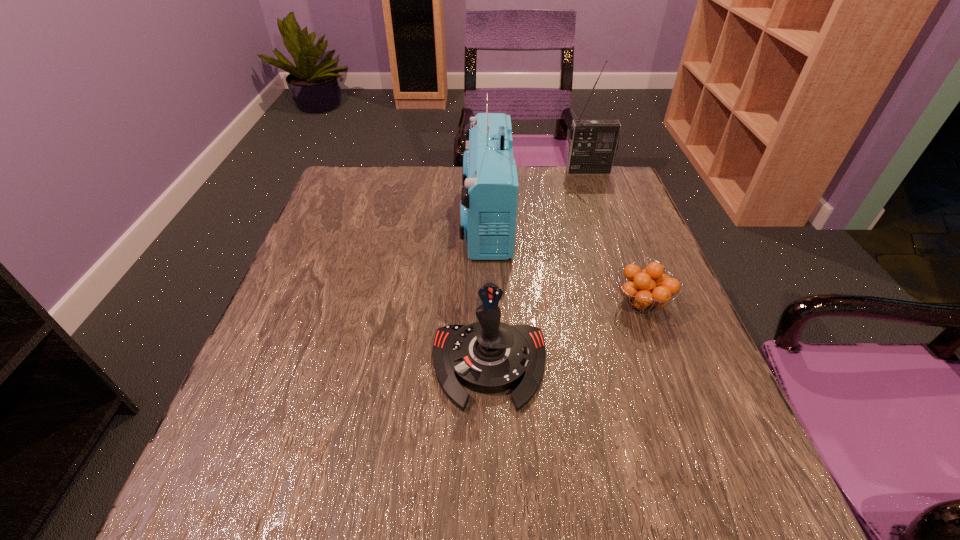
Image resolution: width=960 pixels, height=540 pixels. In order to click on free spot located 0.370m on the front-facing side of the nearer radio receiver in this screenshot , I will do `click(316, 219)`.

Identify the location of vacant region located 0.140m on the front-facing side of the nearer radio receiver. (407, 219).

Locate an element on the screen. The height and width of the screenshot is (540, 960). free space located 0.170m on the handle side of the joystick is located at coordinates (492, 526).

This screenshot has height=540, width=960. In order to click on vacant space situated 0.340m on the back of the third farthest object in this screenshot , I will do `click(602, 195)`.

Locate an element on the screen. The height and width of the screenshot is (540, 960). radio receiver that is at the right edge is located at coordinates (593, 143).

Where is `orange fruit located in the right edge section of the desktop`? orange fruit located in the right edge section of the desktop is located at coordinates (649, 288).

Where is `object positioned at the far right corner`? Image resolution: width=960 pixels, height=540 pixels. object positioned at the far right corner is located at coordinates (593, 143).

I want to click on free space at the far edge, so click(560, 205).

In the image, there is a desktop. Where is `vacant space at the near edge`? Image resolution: width=960 pixels, height=540 pixels. vacant space at the near edge is located at coordinates (606, 491).

Find the location of a particular element. The image size is (960, 540). vacant area at the left edge is located at coordinates (253, 454).